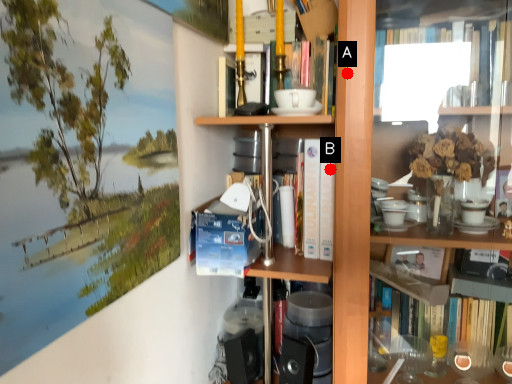
Question: Two points are circled on the image, labeled by A and B beside each circle. Which point is closer to the camera?

Choices:
 (A) A is closer
 (B) B is closer

Answer: (A)